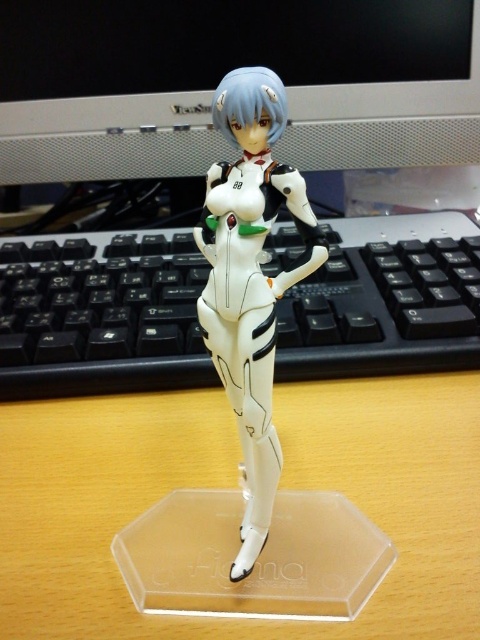
Question: Can you confirm if black plastic keyboard at center is positioned to the right of white glossy figure at center?

Choices:
 (A) yes
 (B) no

Answer: (A)

Question: Is black plastic keyboard at center below matte black monitor at upper center?

Choices:
 (A) no
 (B) yes

Answer: (B)

Question: Based on their relative distances, which object is nearer to the black plastic keyboard at center?

Choices:
 (A) white glossy figure at center
 (B) clear wood table at center

Answer: (B)

Question: Which point is farther to the camera?

Choices:
 (A) matte black monitor at upper center
 (B) clear wood table at center
 (C) white glossy figure at center

Answer: (A)

Question: Is matte black monitor at upper center bigger than white glossy figure at center?

Choices:
 (A) yes
 (B) no

Answer: (A)

Question: Based on their relative distances, which object is farther from the clear wood table at center?

Choices:
 (A) matte black monitor at upper center
 (B) black plastic keyboard at center
 (C) white glossy figure at center

Answer: (A)